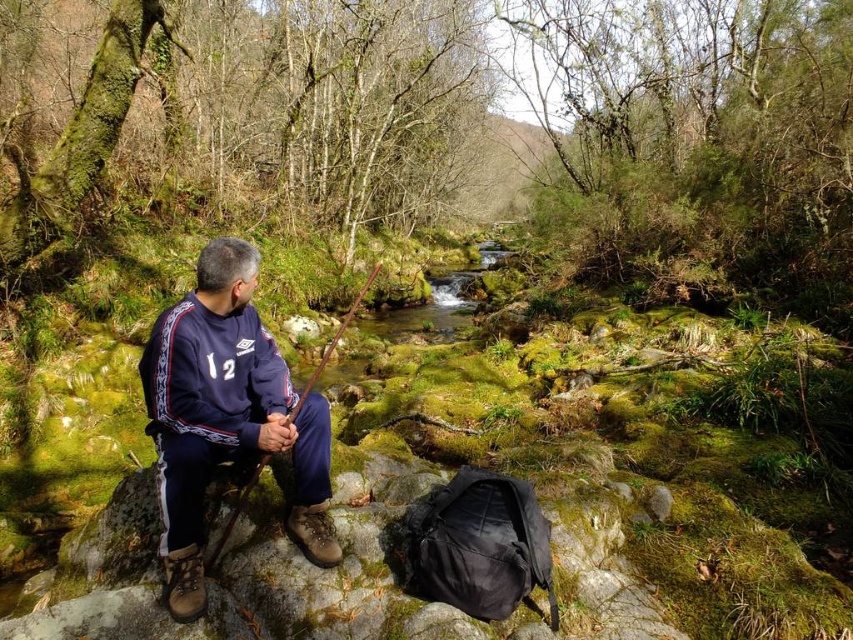
You are a hiker who has just arrived at the scene. You need to locate your dark blue fleece at center. Based on the coordinates provided, where should you look relative to the mossy rocks and the stream?

The dark blue fleece at center is located at coordinates point (225, 417), which places it centrally in the scene. Since the man is sitting by the stream on a mossy rock, the fleece is likely positioned near him, possibly on the rock or nearby ground in the central area.

You are an outdoor enthusiast planning to fish in the stream. You have a dark blue fleece at center and a brown wooden fishing pole at left. Which item should you pick up first if you want to ensure you have enough space in your backpack?

The dark blue fleece at center has a smaller size compared to the brown wooden fishing pole at left, so you should pick up the brown wooden fishing pole at left first to ensure it fits in your backpack.

You are a hiker who has just arrived at the stream and see the dark blue fleece at center and the brown wooden fishing pole at left. Which item is closer to the stream?

The brown wooden fishing pole at left is closer to the stream because it is positioned to the left of the dark blue fleece at center, which is further away from the stream.